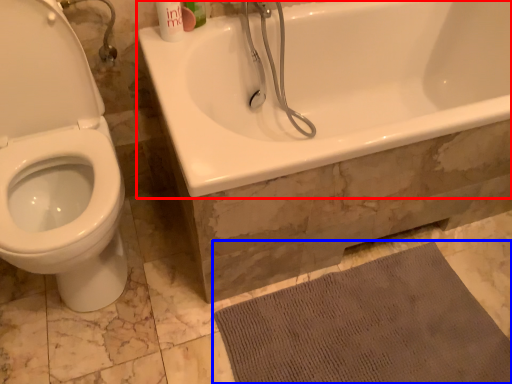
Question: Which point is closer to the camera, bathtub (highlighted by a red box) or bath mat (highlighted by a blue box)?

Choices:
 (A) bathtub
 (B) bath mat

Answer: (A)